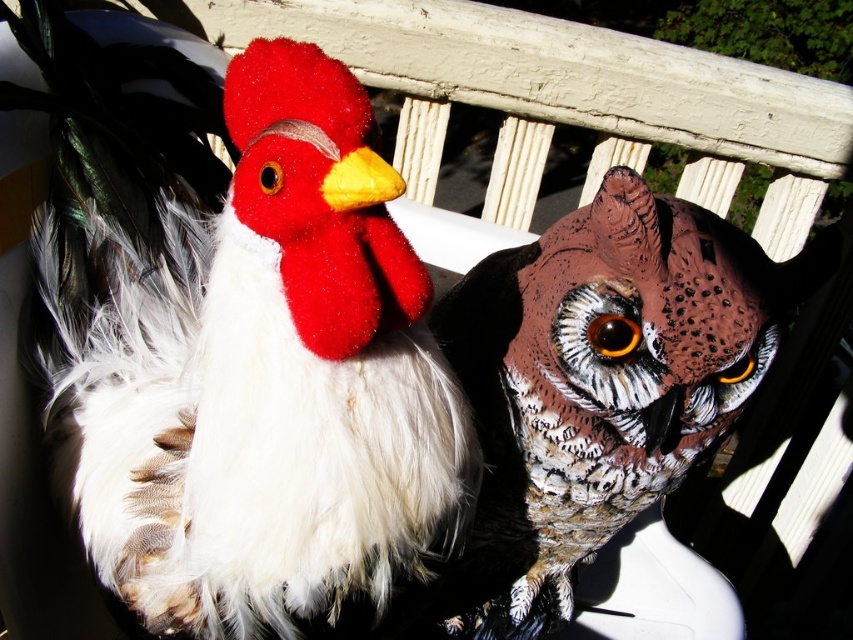
You are trying to place both the white soft plush at center and the speckled brown owl at center on a shelf that can only accommodate items up to 30 cm in width. If the combined width of both objects exceeds this limit, you need to choose which one to keep. Based on their widths, which object should you keep to maximize the shelf space utilized?

The white soft plush at center is wider than the speckled brown owl at center, so you should keep the white soft plush at center to utilize more shelf space.

You are standing in front of two objects on a white wooden surface. You notice two points marked on the image, one at point (405,348) and the other at point (659,246). Which point is closer to you?

Point (405,348) is closer to the viewer than point (659,246).

You are standing in a park and see two objects on a bench. The white soft plush at center and the speckled brown owl at center are both on the bench. Which object is closer to you?

The white soft plush at center is closer to you because it is in front of the speckled brown owl at center.